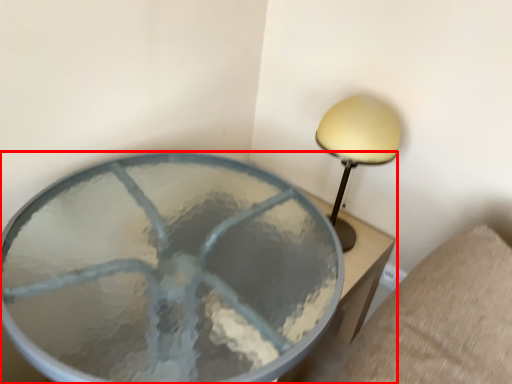
Question: From the image's perspective, considering the relative positions of table (annotated by the red box) and lamp in the image provided, where is table (annotated by the red box) located with respect to the staircase?

Choices:
 (A) below
 (B) above

Answer: (A)